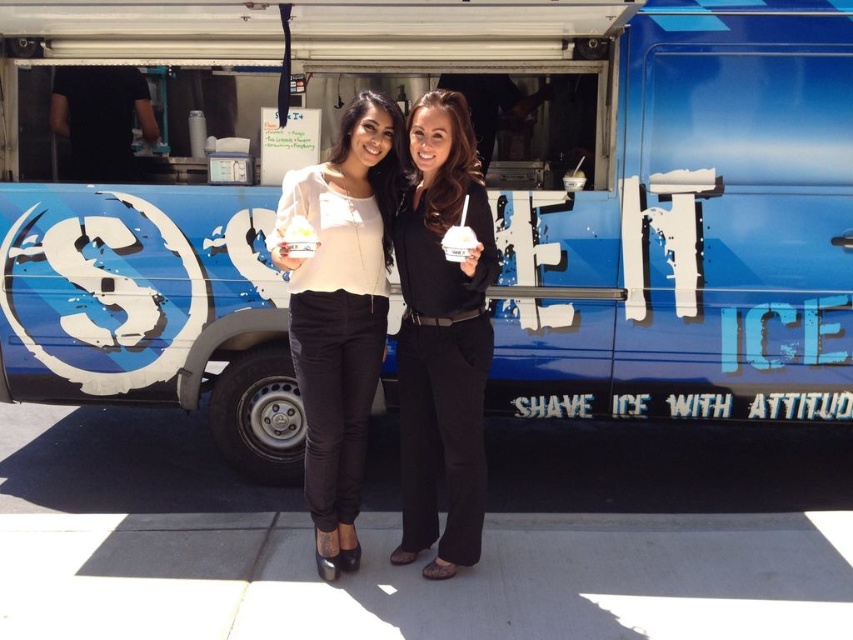
Which is more to the left, matte white blouse at center or white matte ice cream cone at center?

matte white blouse at center is more to the left.

Between point (381, 308) and point (454, 241), which one is positioned behind?

Point (381, 308)

This screenshot has height=640, width=853. In order to click on matte white blouse at center in this screenshot , I will do pos(341,308).

Between black matte pants at center and matte white blouse at center, which one has less height?

black matte pants at center

Is the position of black matte pants at center less distant than that of matte white blouse at center?

Yes.

Image resolution: width=853 pixels, height=640 pixels. In order to click on black matte pants at center in this screenshot , I will do `click(442, 339)`.

Where is `black matte pants at center`? Image resolution: width=853 pixels, height=640 pixels. black matte pants at center is located at coordinates (442, 339).

Is black matte pants at center positioned before white matte ice cream cone at center?

No, it is behind white matte ice cream cone at center.

Between black matte pants at center and white matte ice cream cone at center, which one is positioned higher?

white matte ice cream cone at center is higher up.

Does point (413, 129) come behind point (459, 252)?

Yes, point (413, 129) is behind point (459, 252).

What are the coordinates of `black matte pants at center` in the screenshot? It's located at click(x=442, y=339).